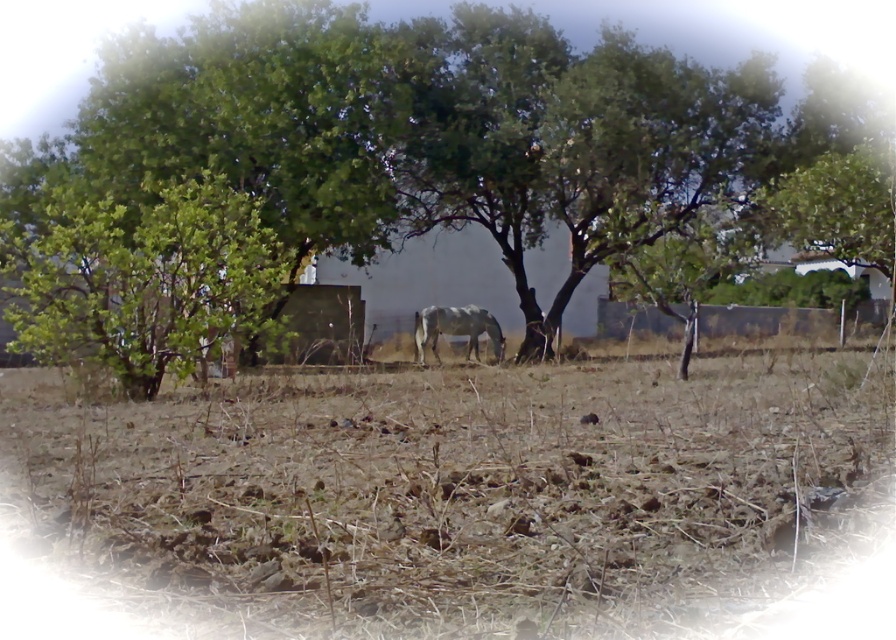
In the scene shown: Which is above, green leafy tree at center or gray matte horse at center?

green leafy tree at center is above.

Who is more forward, (119, 61) or (493, 336)?

Point (493, 336)

Between point (582, 22) and point (485, 324), which one is positioned behind?

The point (582, 22) is more distant.

This screenshot has width=896, height=640. I want to click on green leafy tree at center, so click(836, 24).

Looking at this image, is brown dry dirt at center closer to camera compared to gray matte horse at center?

Yes, it is.

Does brown dry dirt at center have a greater height compared to gray matte horse at center?

No, brown dry dirt at center is not taller than gray matte horse at center.

Between point (685, 564) and point (474, 330), which one is positioned behind?

The point (474, 330) is behind.

You are a GUI agent. You are given a task and a screenshot of the screen. Output one action in this format:
    pyautogui.click(x=<x>, y=<y>)
    Task: Click on the brown dry dirt at center
    The height and width of the screenshot is (640, 896).
    Given the screenshot: What is the action you would take?
    pyautogui.click(x=459, y=483)

Does brown dry dirt at center lie behind green leafy tree at center?

That is False.

Can you confirm if brown dry dirt at center is positioned above green leafy tree at center?

No, brown dry dirt at center is not above green leafy tree at center.

Is point (832, 609) less distant than point (781, 157)?

Yes.

At what (x,y) coordinates should I click in order to perform the action: click on brown dry dirt at center. Please return your answer as a coordinate pair (x, y). The height and width of the screenshot is (640, 896). Looking at the image, I should click on (459, 483).